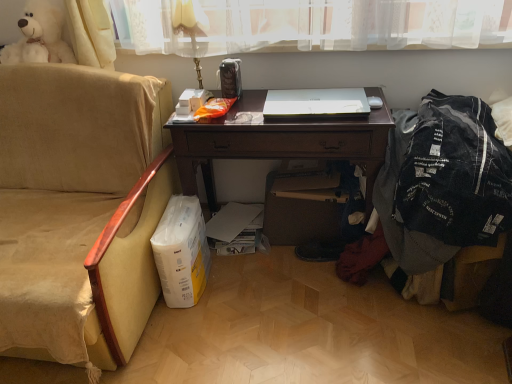
Question: Is white glossy laptop at center to the right of denim jacket at right from the viewer's perspective?

Choices:
 (A) yes
 (B) no

Answer: (B)

Question: From a real-world perspective, is white glossy laptop at center under denim jacket at right?

Choices:
 (A) yes
 (B) no

Answer: (B)

Question: Would you say white glossy laptop at center is a long distance from denim jacket at right?

Choices:
 (A) yes
 (B) no

Answer: (B)

Question: Is white glossy laptop at center oriented away from denim jacket at right?

Choices:
 (A) yes
 (B) no

Answer: (B)

Question: From the image's perspective, is white glossy laptop at center under denim jacket at right?

Choices:
 (A) yes
 (B) no

Answer: (B)

Question: Considering the relative sizes of white glossy laptop at center and denim jacket at right in the image provided, is white glossy laptop at center shorter than denim jacket at right?

Choices:
 (A) yes
 (B) no

Answer: (A)

Question: Can you confirm if white plush bear at upper left is shorter than beige fabric chair at left?

Choices:
 (A) yes
 (B) no

Answer: (A)

Question: Does white plush bear at upper left turn towards beige fabric chair at left?

Choices:
 (A) no
 (B) yes

Answer: (A)

Question: Is white plush bear at upper left oriented away from beige fabric chair at left?

Choices:
 (A) no
 (B) yes

Answer: (A)

Question: Is white plush bear at upper left to the left of beige fabric chair at left from the viewer's perspective?

Choices:
 (A) no
 (B) yes

Answer: (A)

Question: From the image's perspective, would you say white plush bear at upper left is shown under beige fabric chair at left?

Choices:
 (A) yes
 (B) no

Answer: (B)

Question: Does white plush bear at upper left have a greater width compared to beige fabric chair at left?

Choices:
 (A) yes
 (B) no

Answer: (B)

Question: Is beige fabric chair at left positioned with its back to gold metallic table lamp at upper center?

Choices:
 (A) yes
 (B) no

Answer: (B)